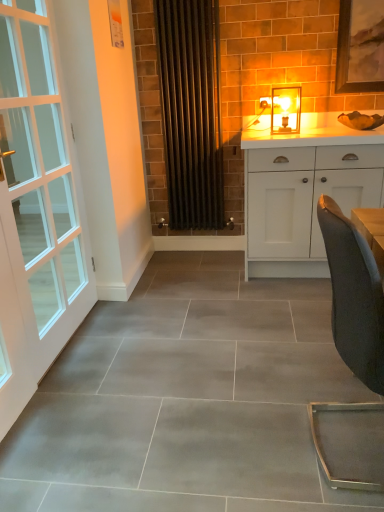
Where is `free space behind matte glass lampshade at upper center`? This screenshot has width=384, height=512. free space behind matte glass lampshade at upper center is located at coordinates (287, 129).